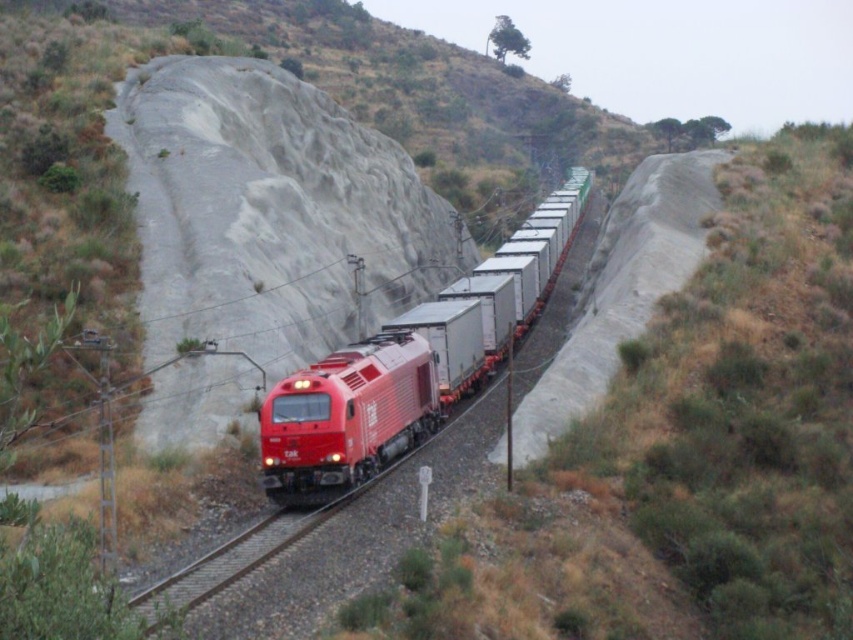
You are a railway inspector checking the clearance of the track. The standard width for the track is 1.4 meters. Can the metallic red train at center safely pass through the metal train track at center without getting stuck?

The metallic red train at center might be wider than the metal train track at center, so there is a risk that it may not fit safely. Further measurements are needed to confirm.

You are a passenger on a train traveling along a single track bordered by retaining walls. You notice a point marked at coordinates (369, 401). What object is located at this point?

The metallic red train at center is represented by point (369, 401).

You are a photographer planning to take a photo of the metallic red train at center and the metal train track at center. Which object should you focus on if you want to capture the larger subject in your shot?

The metallic red train at center is bigger than the metal train track at center, so you should focus on the metallic red train at center to capture the larger subject.